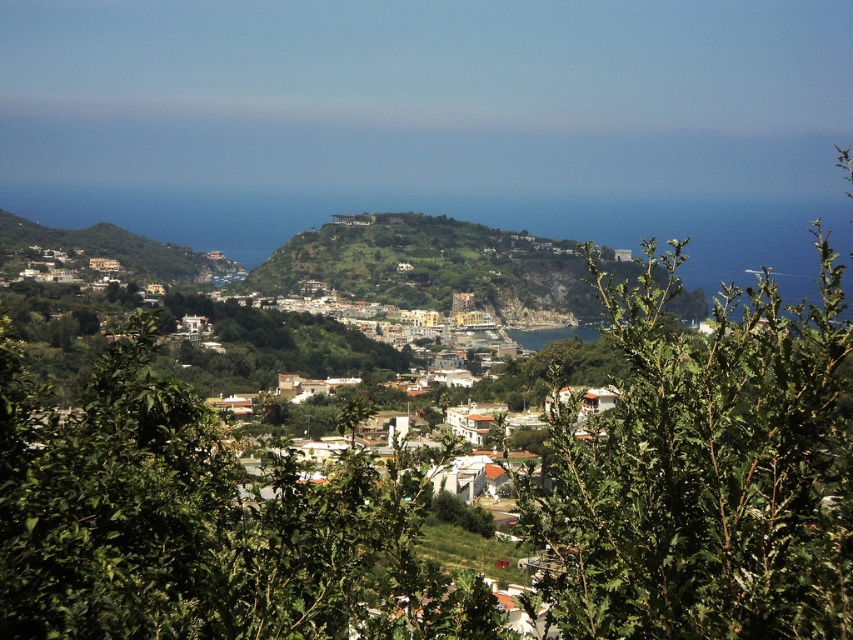
In the scene shown: You are a hiker who wants to take a photo of the coastal town in the midground. However, you notice two green leafy plants blocking your view. Which of the two, the green leafy bush at center or the green leafy tree at center, is bigger and might block more of the view?

The green leafy bush at center is larger than the green leafy tree at center, so it might block more of the view.

You are standing at the center of the image and want to walk towards the green leafy bush at center. Which direction should you move?

The green leafy bush at center is already at the center of the image, so you don not need to move in any direction to reach it.